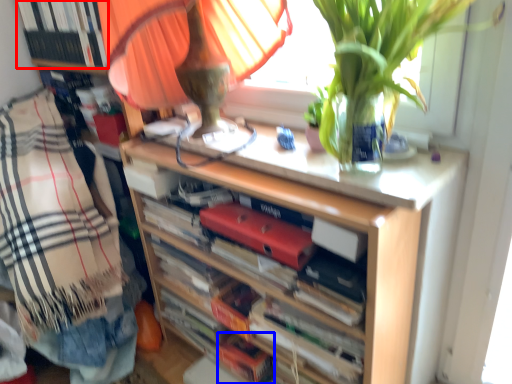
Question: Among these objects, which one is nearest to the camera, book (highlighted by a red box) or book (highlighted by a blue box)?

Choices:
 (A) book
 (B) book

Answer: (A)